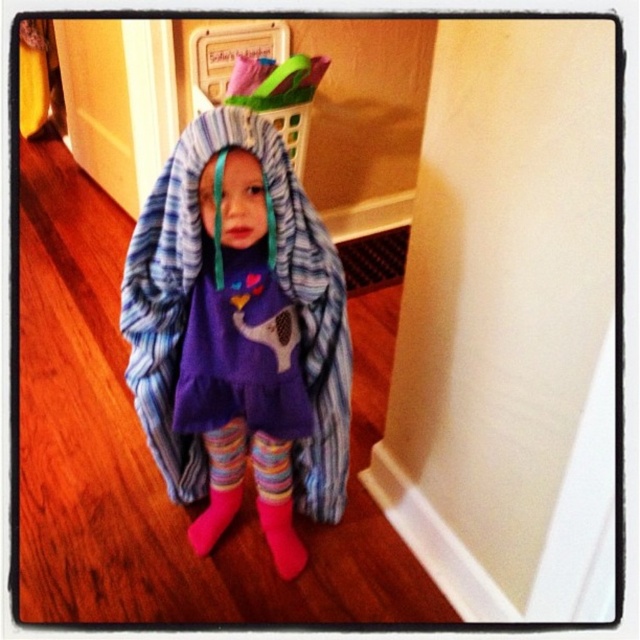
Is point (150, 388) behind point (237, 508)?

No, (150, 388) is closer to viewer.

Measure the distance between striped fleece blanket at center and camera.

striped fleece blanket at center is 3.48 feet away from camera.

The width and height of the screenshot is (640, 640). Identify the location of striped fleece blanket at center. (189, 301).

Who is positioned more to the right, pink fuzzy socks at lower center or pink fuzzy sock at lower center?

Positioned to the right is pink fuzzy socks at lower center.

Can you confirm if pink fuzzy socks at lower center is positioned below pink fuzzy sock at lower center?

Yes.

Is point (284, 536) positioned after point (225, 529)?

No, it is not.

In order to click on pink fuzzy socks at lower center in this screenshot , I will do `click(282, 536)`.

Who is higher up, striped fleece blanket at center or pink fuzzy socks at lower center?

striped fleece blanket at center is above.

Between point (282, 284) and point (259, 502), which one is positioned in front?

Point (282, 284) is in front.

Find the location of `striped fleece blanket at center`. striped fleece blanket at center is located at coordinates (189, 301).

I want to click on striped fleece blanket at center, so click(x=189, y=301).